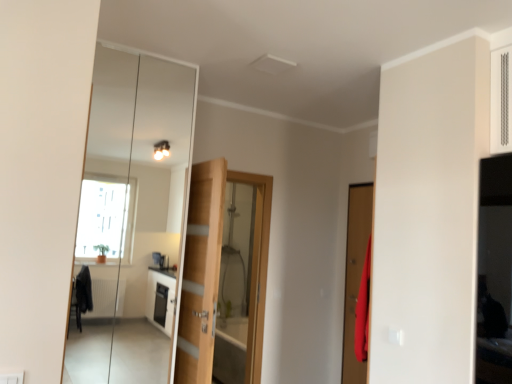
This screenshot has width=512, height=384. What are the coordinates of `matte wooden door at right, which is the 1th door from front to back` in the screenshot? It's located at (355, 275).

The image size is (512, 384). What do you see at coordinates (217, 273) in the screenshot?
I see `wooden door at center, placed as the first door when sorted from left to right` at bounding box center [217, 273].

Locate an element on the screen. This screenshot has width=512, height=384. clear glass mirror at center is located at coordinates (131, 217).

Is wooden door at center, positioned as the 2th door in right-to-left order, not near clear glass mirror at center?

Yes, wooden door at center, positioned as the 2th door in right-to-left order, and clear glass mirror at center are located far from each other.

Is point (206, 199) farther from viewer compared to point (128, 243)?

No, it is in front of (128, 243).

Does wooden door at center, the 2th door from the front, have a lesser height compared to clear glass mirror at center?

Indeed, wooden door at center, the 2th door from the front, has a lesser height compared to clear glass mirror at center.

Does wooden door at center, positioned as the 2th door in right-to-left order, have a lesser width compared to clear glass mirror at center?

Yes.

Which of these two, matte wooden door at right, which ranks as the second door in left-to-right order, or clear glass mirror at center, is smaller?

matte wooden door at right, which ranks as the second door in left-to-right order.

Which object is positioned more to the left, matte wooden door at right, which is counted as the first door, starting from the right, or clear glass mirror at center?

Positioned to the left is clear glass mirror at center.

Is clear glass mirror at center inside matte wooden door at right, which ranks as the second door in left-to-right order?

Definitely not — clear glass mirror at center is not inside matte wooden door at right, which ranks as the second door in left-to-right order.

From a real-world perspective, which is physically below, matte wooden door at right, which is the 1th door from front to back, or clear glass mirror at center?

From a 3D spatial view, matte wooden door at right, which is the 1th door from front to back, is below.

Between matte wooden door at right, which ranks as the second door in left-to-right order, and wooden door at center, marked as the first door in a back-to-front arrangement, which one is positioned in front?

matte wooden door at right, which ranks as the second door in left-to-right order, is in front.

Which object is wider, matte wooden door at right, which is the 1th door from front to back, or wooden door at center, positioned as the 2th door in right-to-left order?

matte wooden door at right, which is the 1th door from front to back.

From the image's perspective, is matte wooden door at right, which ranks as the second door in left-to-right order, under wooden door at center, marked as the first door in a back-to-front arrangement?

No.

Is matte wooden door at right, which is counted as the first door, starting from the right, to the left or to the right of wooden door at center, placed as the first door when sorted from left to right, in the image?

Clearly, matte wooden door at right, which is counted as the first door, starting from the right, is on the right of wooden door at center, placed as the first door when sorted from left to right, in the image.

From a real-world perspective, who is located higher, clear glass mirror at center or wooden door at center, the 2th door from the front?

clear glass mirror at center.

Who is more distant, clear glass mirror at center or wooden door at center, the 2th door from the front?

wooden door at center, the 2th door from the front, is behind.

Between clear glass mirror at center and wooden door at center, marked as the first door in a back-to-front arrangement, which one has larger width?

clear glass mirror at center is wider.

Is clear glass mirror at center in contact with wooden door at center, placed as the first door when sorted from left to right?

No, clear glass mirror at center is not touching wooden door at center, placed as the first door when sorted from left to right.

Which object is positioned more to the right, clear glass mirror at center or matte wooden door at right, which is the 1th door from front to back?

From the viewer's perspective, matte wooden door at right, which is the 1th door from front to back, appears more on the right side.

Considering the sizes of objects clear glass mirror at center and matte wooden door at right, which is counted as the second door, starting from the back, in the image provided, who is taller, clear glass mirror at center or matte wooden door at right, which is counted as the second door, starting from the back,?

With more height is clear glass mirror at center.

Is clear glass mirror at center not close to matte wooden door at right, which ranks as the second door in left-to-right order?

Indeed, clear glass mirror at center is not near matte wooden door at right, which ranks as the second door in left-to-right order.

Is wooden door at center, positioned as the 2th door in right-to-left order, next to matte wooden door at right, which is counted as the first door, starting from the right?

wooden door at center, positioned as the 2th door in right-to-left order, is not next to matte wooden door at right, which is counted as the first door, starting from the right, and they're not touching.

Considering the positions of objects wooden door at center, positioned as the 2th door in right-to-left order, and matte wooden door at right, which is counted as the second door, starting from the back, in the image provided, who is more to the left, wooden door at center, positioned as the 2th door in right-to-left order, or matte wooden door at right, which is counted as the second door, starting from the back,?

wooden door at center, positioned as the 2th door in right-to-left order.

From the image's perspective, relative to matte wooden door at right, which is counted as the second door, starting from the back, is wooden door at center, the 2th door from the front, above or below?

From the image's perspective, wooden door at center, the 2th door from the front, appears below matte wooden door at right, which is counted as the second door, starting from the back.

Where is `the 2nd door directly beneath the clear glass mirror at center (from a real-world perspective)`? This screenshot has width=512, height=384. the 2nd door directly beneath the clear glass mirror at center (from a real-world perspective) is located at coordinates (217, 273).

This screenshot has width=512, height=384. There is a matte wooden door at right, which is the 1th door from front to back. What are the coordinates of `mirror above it (from a real-world perspective)` in the screenshot? It's located at (131, 217).

When comparing their distances from clear glass mirror at center, does matte wooden door at right, which is the 1th door from front to back, or wooden door at center, marked as the first door in a back-to-front arrangement, seem closer?

matte wooden door at right, which is the 1th door from front to back, is positioned closer to the anchor clear glass mirror at center.

From the image, which object appears to be farther from wooden door at center, marked as the first door in a back-to-front arrangement, matte wooden door at right, which ranks as the second door in left-to-right order, or clear glass mirror at center?

Based on the image, clear glass mirror at center appears to be further to wooden door at center, marked as the first door in a back-to-front arrangement.

Considering their positions, is clear glass mirror at center positioned further to wooden door at center, placed as the first door when sorted from left to right, than matte wooden door at right, which is counted as the first door, starting from the right?

clear glass mirror at center is positioned further to the anchor wooden door at center, placed as the first door when sorted from left to right.

From the image, which object appears to be nearer to matte wooden door at right, which is counted as the second door, starting from the back, clear glass mirror at center or wooden door at center, positioned as the 2th door in right-to-left order?

wooden door at center, positioned as the 2th door in right-to-left order.

From the image, which object appears to be farther from clear glass mirror at center, wooden door at center, positioned as the 2th door in right-to-left order, or matte wooden door at right, which ranks as the second door in left-to-right order?

The object further to clear glass mirror at center is wooden door at center, positioned as the 2th door in right-to-left order.

Which object lies further to the anchor point matte wooden door at right, which is counted as the first door, starting from the right, wooden door at center, positioned as the 2th door in right-to-left order, or clear glass mirror at center?

clear glass mirror at center is positioned further to the anchor matte wooden door at right, which is counted as the first door, starting from the right.

Where is `door between clear glass mirror at center and matte wooden door at right, which ranks as the second door in left-to-right order`? door between clear glass mirror at center and matte wooden door at right, which ranks as the second door in left-to-right order is located at coordinates (217, 273).